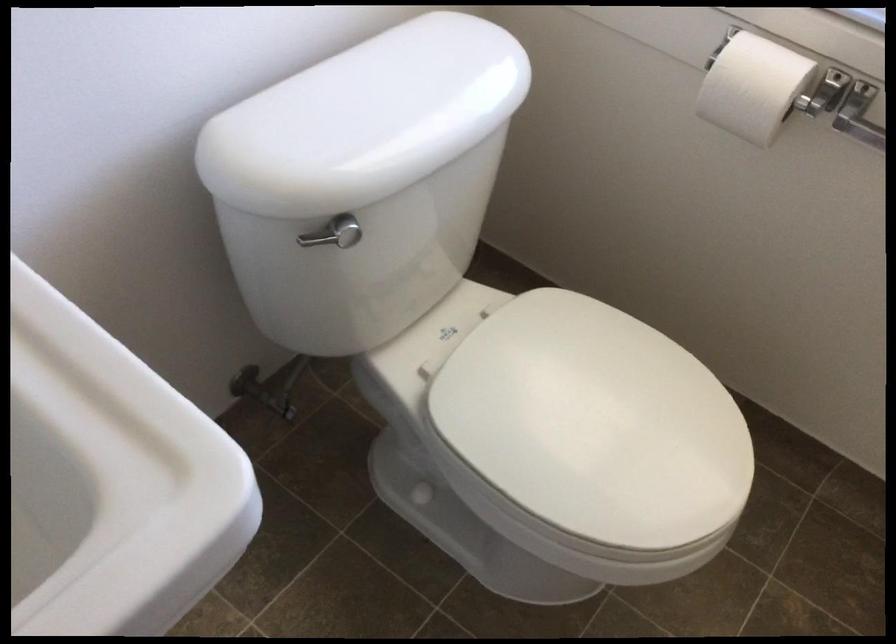
Where is `toilet paper roll`? The height and width of the screenshot is (644, 896). toilet paper roll is located at coordinates (753, 87).